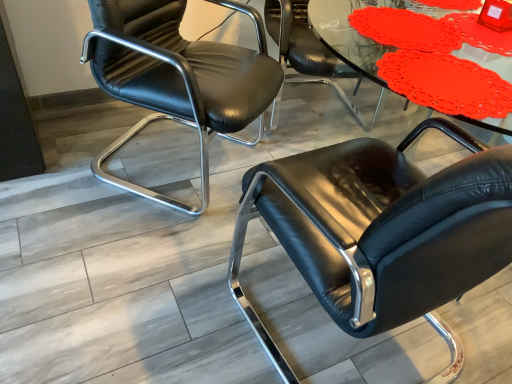
This screenshot has width=512, height=384. In order to click on blank space to the left of black leather chair at left, placed as the 1th chair when sorted from left to right in this screenshot , I will do `click(75, 152)`.